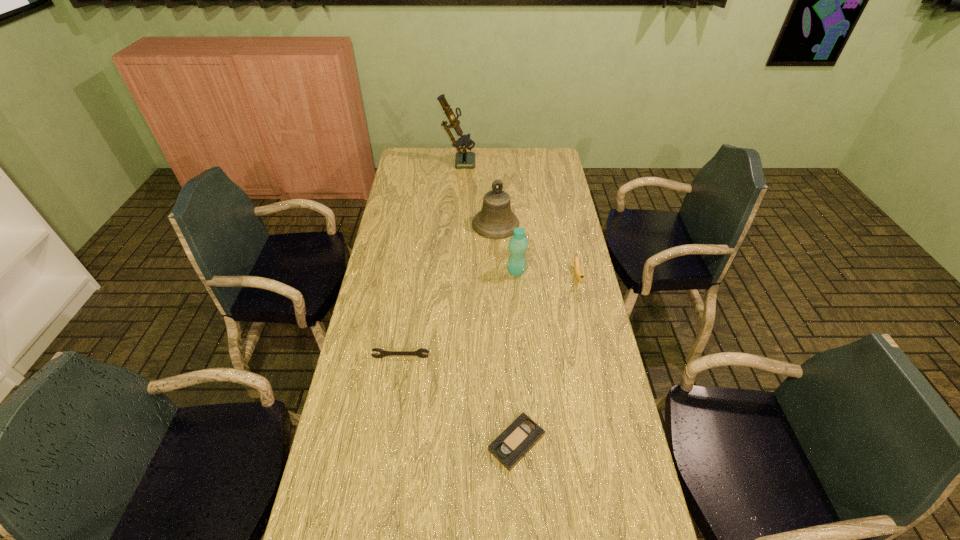
Identify the location of the tallest object. The width and height of the screenshot is (960, 540). (464, 159).

Where is `microscope`? microscope is located at coordinates (464, 159).

At what (x,y) coordinates should I click in order to perform the action: click on bell. Please return your answer as a coordinate pair (x, y). The width and height of the screenshot is (960, 540). Looking at the image, I should click on (495, 220).

You are a GUI agent. You are given a task and a screenshot of the screen. Output one action in this format:
    pyautogui.click(x=<x>, y=<y>)
    Task: Click on the bottle
    
    Given the screenshot: What is the action you would take?
    pyautogui.click(x=518, y=243)

Locate an element on the screen. the rightmost object is located at coordinates coord(579,277).

Where is `banana`? The height and width of the screenshot is (540, 960). banana is located at coordinates tap(579, 277).

The width and height of the screenshot is (960, 540). In order to click on the second nearest object in this screenshot , I will do [x=383, y=353].

You are a GUI agent. You are given a task and a screenshot of the screen. Output one action in this format:
    pyautogui.click(x=<x>, y=<y>)
    Task: Click on the wrench
    This screenshot has height=540, width=960.
    Given the screenshot: What is the action you would take?
    pyautogui.click(x=383, y=353)

The image size is (960, 540). In order to click on videotape in this screenshot , I will do `click(521, 435)`.

At what (x,y) coordinates should I click in order to perform the action: click on the nearest object. Please return your answer as a coordinate pair (x, y). Looking at the image, I should click on (521, 435).